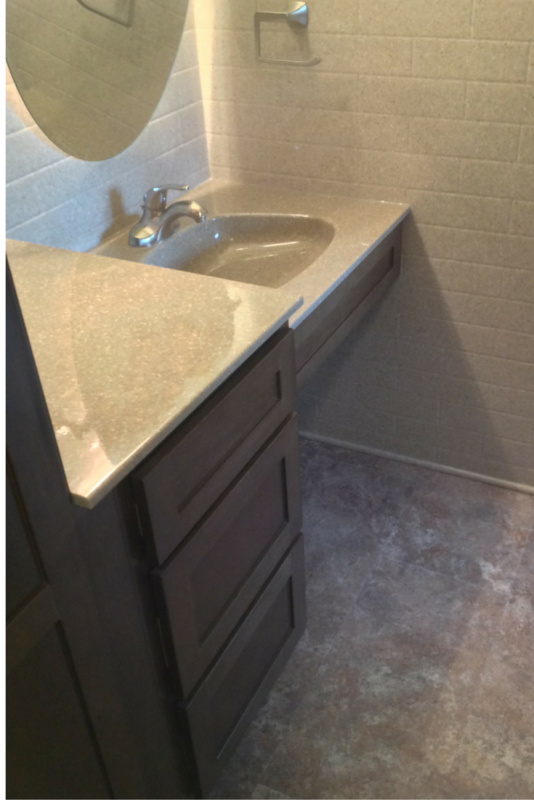
You are a GUI agent. You are given a task and a screenshot of the screen. Output one action in this format:
    pyautogui.click(x=<x>, y=<y>)
    Task: Click on the wall
    Image resolution: width=534 pixels, height=800 pixels.
    Given the screenshot: What is the action you would take?
    pyautogui.click(x=479, y=294)